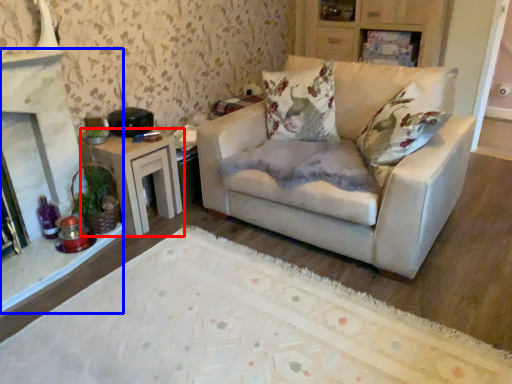
Question: Among these objects, which one is farthest to the camera, table (highlighted by a red box) or fireplace (highlighted by a blue box)?

Choices:
 (A) table
 (B) fireplace

Answer: (A)